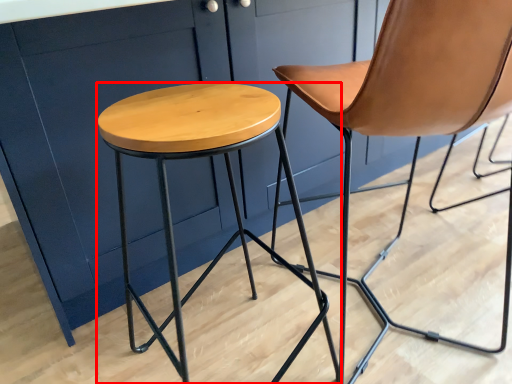
Question: Where is stool (annotated by the red box) located in relation to chair in the image?

Choices:
 (A) left
 (B) right

Answer: (A)